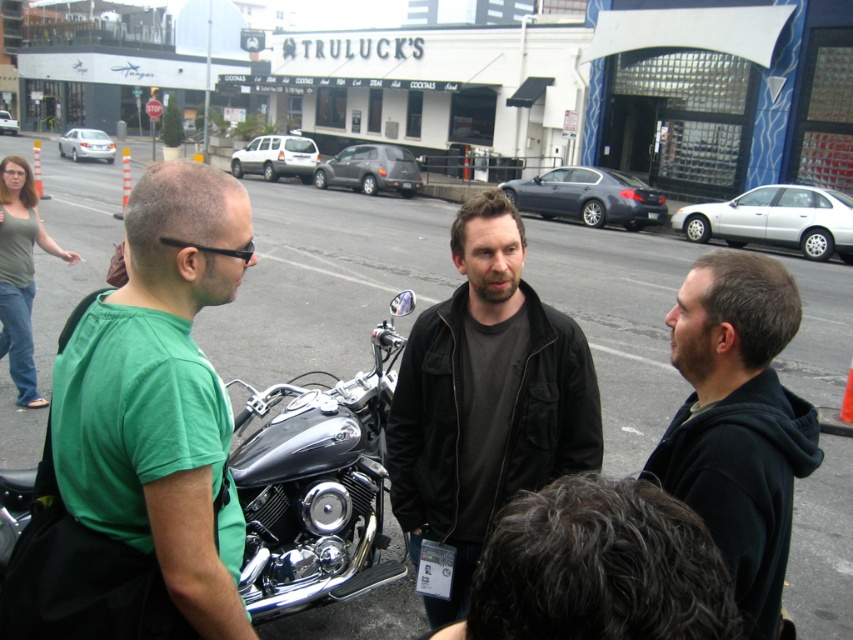
You are a pedestrian trying to cross the street and see the dark gray fabric jacket at center and the shiny chrome motorcycle at center. Which object is closer to you?

The dark gray fabric jacket at center is closer to the viewer than the shiny chrome motorcycle at center.

You are a photographer trying to capture a photo of the dark gray fabric jacket at center and the shiny chrome motorcycle at center. Since you want the motorcycle to be the main focus, should you position the jacket to the left or right of the motorcycle?

The dark gray fabric jacket at center is positioned on the right side of the shiny chrome motorcycle at center. To keep the motorcycle as the main focus, you should position the jacket to the right of the motorcycle since it is already there, ensuring the motorcycle remains centered and prominent.